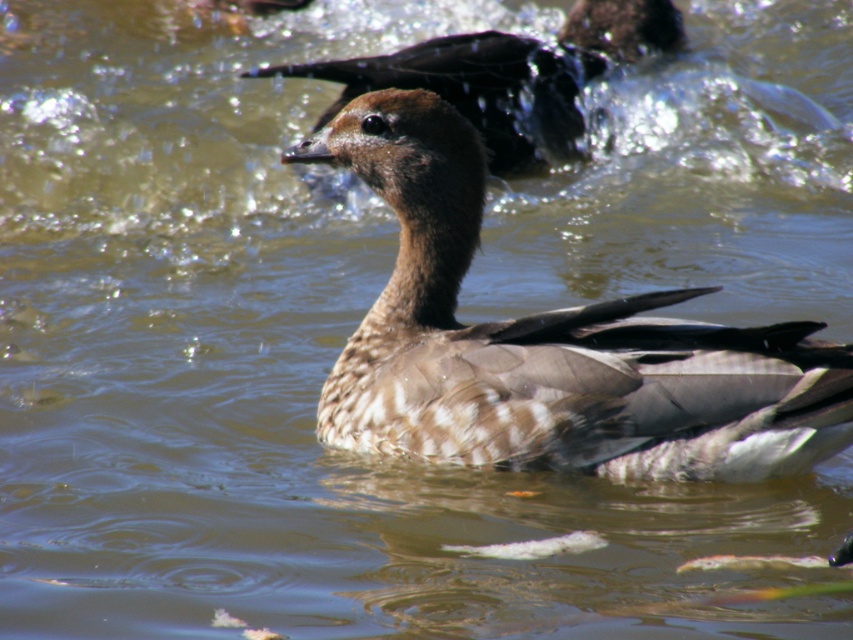
Question: Can you confirm if brown feathered duck at center is wider than brown feathered goose at upper center?

Choices:
 (A) yes
 (B) no

Answer: (B)

Question: Can you confirm if brown feathered duck at center is positioned above brown feathered goose at upper center?

Choices:
 (A) yes
 (B) no

Answer: (B)

Question: Which point appears closest to the camera in this image?

Choices:
 (A) (486, 61)
 (B) (846, 385)

Answer: (B)

Question: In this image, where is brown feathered duck at center located relative to brown feathered goose at upper center?

Choices:
 (A) above
 (B) below

Answer: (B)